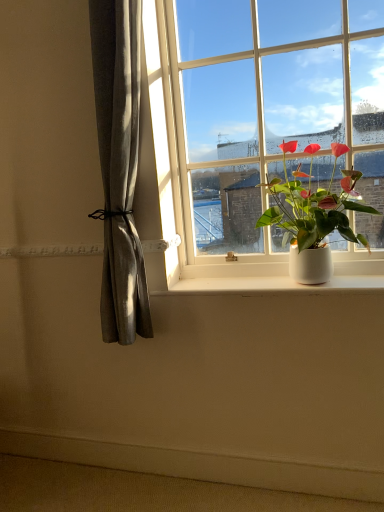
Find the location of `free spot above white smooth window sill at lower center (from a real-world perspective)`. free spot above white smooth window sill at lower center (from a real-world perspective) is located at coordinates (259, 279).